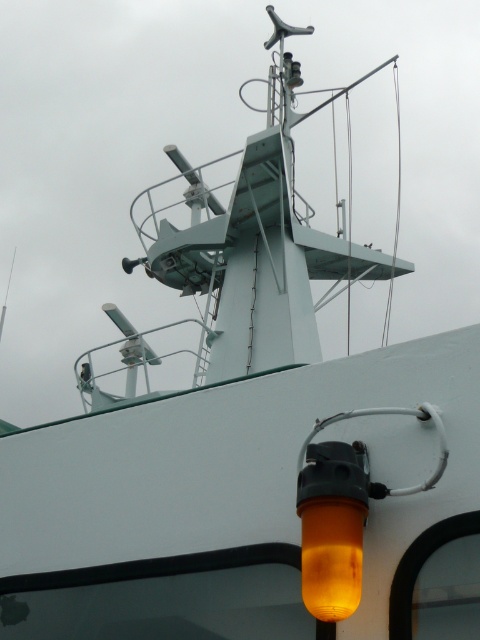
You are a sailor on the ship and need to identify the lighting fixtures. Which one is bigger between the orange translucent lamp at lower right and the orange translucent light at lower right?

The orange translucent lamp at lower right is larger in size than the orange translucent light at lower right.

In the scene shown: You are standing on the ship deck and want to reach the orange translucent lamp at lower right. Considering your height is 5.5 feet, will you be able to touch it without any assistance?

The orange translucent lamp at lower right is 9.36 feet away from you, which is farther than your height of 5.5 feet. Therefore, you cannot touch it without assistance.